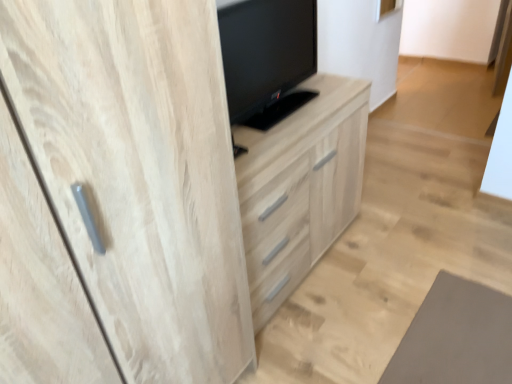
Describe the element at coordinates (300, 187) in the screenshot. I see `light wood cabinet at center` at that location.

You are a GUI agent. You are given a task and a screenshot of the screen. Output one action in this format:
    pyautogui.click(x=<x>, y=<y>)
    Task: Click on the light wood cabinet at center
    Image resolution: width=512 pixels, height=384 pixels.
    Given the screenshot: What is the action you would take?
    pyautogui.click(x=300, y=187)

What do you see at coordinates (267, 58) in the screenshot? Image resolution: width=512 pixels, height=384 pixels. I see `black glossy tv at center` at bounding box center [267, 58].

Locate an element on the screen. black glossy tv at center is located at coordinates (267, 58).

I want to click on light wood cabinet at center, so click(300, 187).

Which object is positioned more to the left, light wood cabinet at center or black glossy tv at center?

black glossy tv at center is more to the left.

Relative to black glossy tv at center, is light wood cabinet at center in front or behind?

light wood cabinet at center is behind black glossy tv at center.

Considering the positions of point (266, 228) and point (226, 33), is point (266, 228) closer or farther from the camera than point (226, 33)?

Point (266, 228) is farther from the camera than point (226, 33).

From the image's perspective, is light wood cabinet at center under black glossy tv at center?

Yes.

From a real-world perspective, is light wood cabinet at center positioned above or below black glossy tv at center?

In terms of real-world spatial position, light wood cabinet at center is below black glossy tv at center.

Which object is thinner, light wood cabinet at center or black glossy tv at center?

Thinner between the two is black glossy tv at center.

Can you confirm if light wood cabinet at center is shorter than black glossy tv at center?

No.

Is light wood cabinet at center bigger than black glossy tv at center?

Yes, light wood cabinet at center is bigger than black glossy tv at center.

Could black glossy tv at center be considered to be inside light wood cabinet at center?

No, black glossy tv at center is not inside light wood cabinet at center.

Is light wood cabinet at center next to black glossy tv at center?

No, light wood cabinet at center is not in contact with black glossy tv at center.

Does light wood cabinet at center turn towards black glossy tv at center?

No, light wood cabinet at center is not oriented towards black glossy tv at center.

This screenshot has height=384, width=512. Identify the location of chest of drawers below the black glossy tv at center (from the image's perspective). (300, 187).

Considering the positions of objects black glossy tv at center and light wood cabinet at center in the image provided, who is more to the right, black glossy tv at center or light wood cabinet at center?

light wood cabinet at center.

Which object is closer to the camera taking this photo, black glossy tv at center or light wood cabinet at center?

black glossy tv at center is in front.

Is point (251, 89) closer to camera compared to point (344, 165)?

Yes.

Consider the image. From the image's perspective, who appears lower, black glossy tv at center or light wood cabinet at center?

light wood cabinet at center appears lower in the image.

Looking at this image, from a real-world perspective, is black glossy tv at center located higher than light wood cabinet at center?

Yes, from a real-world perspective, black glossy tv at center is over light wood cabinet at center

Which of these two, black glossy tv at center or light wood cabinet at center, is wider?

Wider between the two is light wood cabinet at center.

Who is taller, black glossy tv at center or light wood cabinet at center?

light wood cabinet at center is taller.

Considering the relative sizes of black glossy tv at center and light wood cabinet at center in the image provided, is black glossy tv at center smaller than light wood cabinet at center?

Indeed, black glossy tv at center has a smaller size compared to light wood cabinet at center.

Is black glossy tv at center not within light wood cabinet at center?

black glossy tv at center is positioned outside light wood cabinet at center.

Based on the photo, is black glossy tv at center in contact with light wood cabinet at center?

No, black glossy tv at center is not touching light wood cabinet at center.

Is black glossy tv at center oriented towards light wood cabinet at center?

No, black glossy tv at center is not facing towards light wood cabinet at center.

Can you tell me how much black glossy tv at center and light wood cabinet at center differ in facing direction?

The angle between the facing direction of black glossy tv at center and the facing direction of light wood cabinet at center is 2.31 degrees.

Locate an element on the screen. Image resolution: width=512 pixels, height=384 pixels. television located on the left of light wood cabinet at center is located at coordinates (267, 58).

Identify the location of television on the left of light wood cabinet at center. The height and width of the screenshot is (384, 512). (x=267, y=58).

Find the location of `television lying above the light wood cabinet at center (from the image's perspective)`. television lying above the light wood cabinet at center (from the image's perspective) is located at coordinates (267, 58).